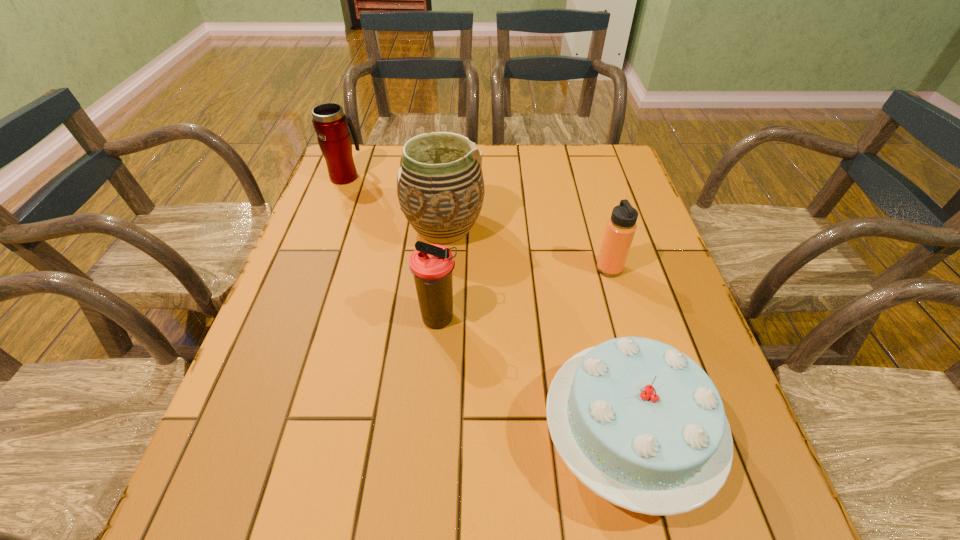
Locate an element on the screen. This screenshot has width=960, height=540. free spot that satisfies the following two spatial constraints: 1. on the front side of the fourth farthest object; 2. on the left side of the second farthest object is located at coordinates (436, 320).

The height and width of the screenshot is (540, 960). Identify the location of vacant position in the image that satisfies the following two spatial constraints: 1. on the front side of the fourth nearest object; 2. on the right side of the birthday cake. (425, 438).